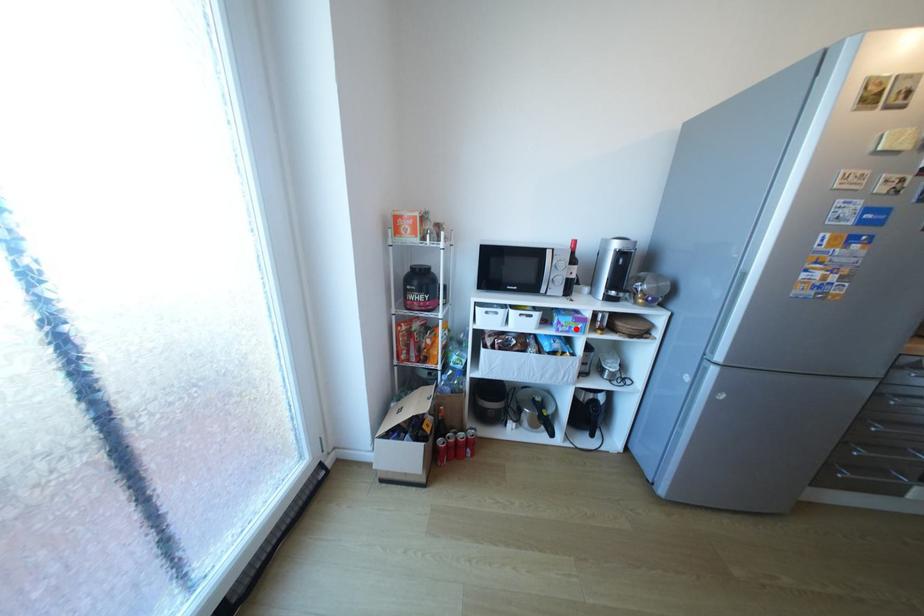
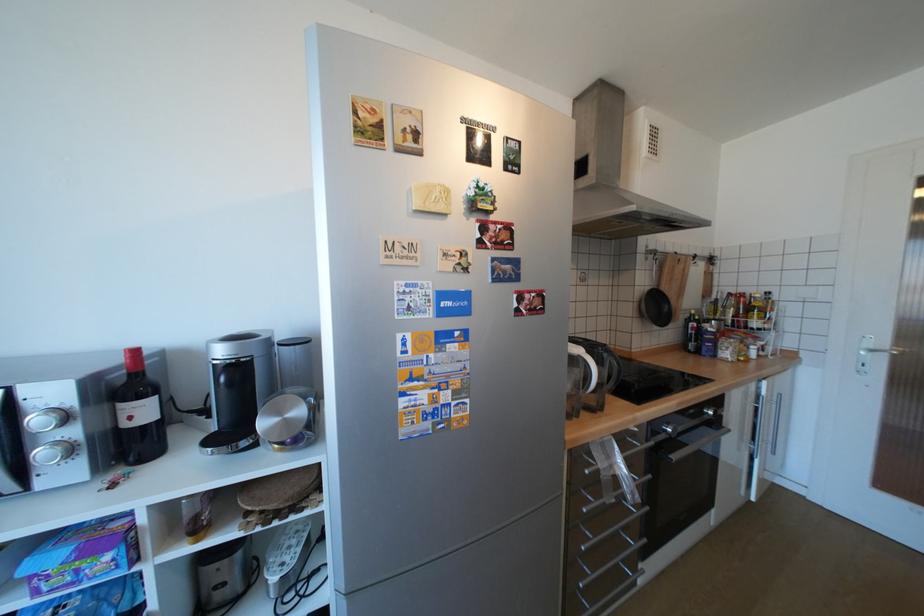
Question: I am providing you with two images of the same scene from different viewpoints. Image1 has a red point marked. In image2, the corresponding 3D location appears at what relative position? Reply with the corresponding letter.

Choices:
 (A) Closer
 (B) Farther

Answer: (A)